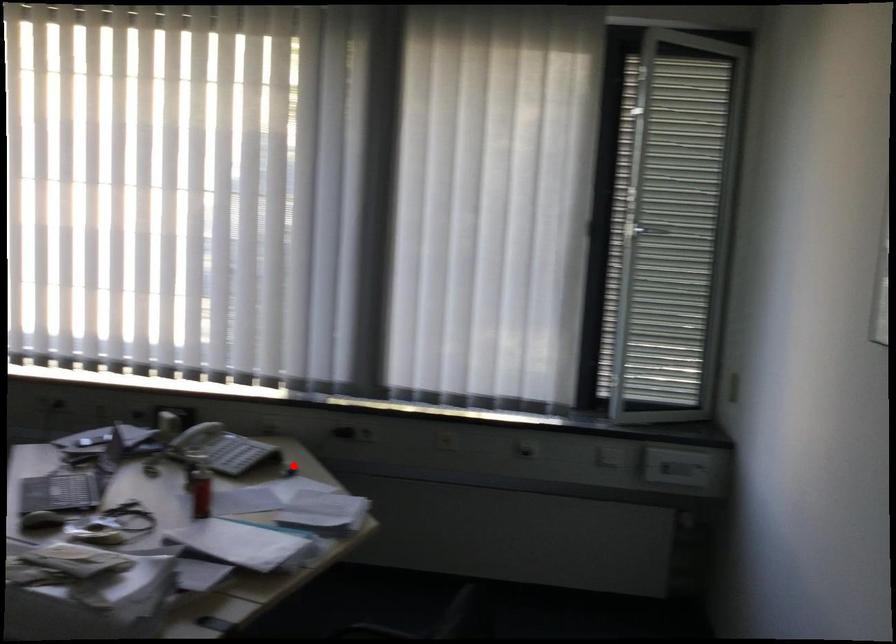
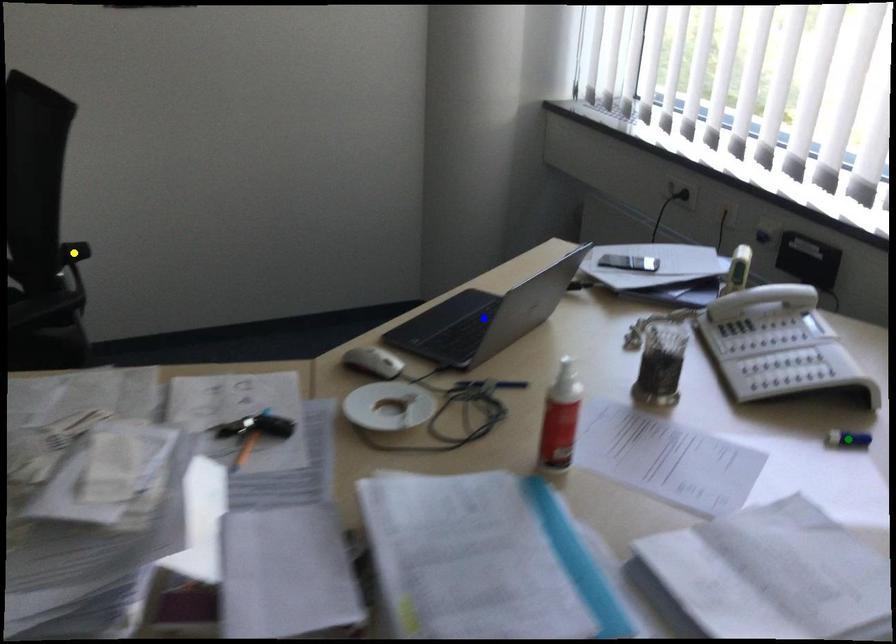
Question: I am providing you with two images of the same scene from different viewpoints. A red point is marked on the first image. You are given multiple points on the second image. Which point in image 2 is actually the same real-world point as the red point in image 1?

Choices:
 (A) green point
 (B) blue point
 (C) yellow point

Answer: (A)